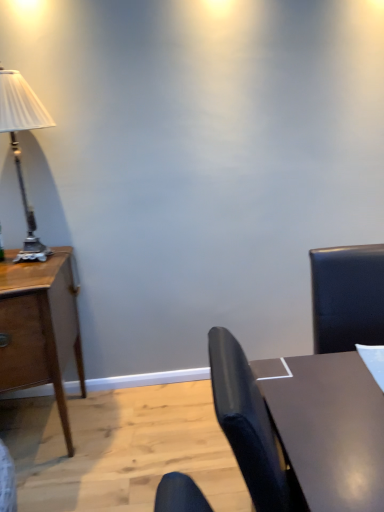
What do you see at coordinates (18, 146) in the screenshot? I see `silver metallic lamp at left` at bounding box center [18, 146].

The width and height of the screenshot is (384, 512). Find the location of `shiny brown table at lower right`. shiny brown table at lower right is located at coordinates (328, 426).

I want to click on wooden desk at left, so click(x=40, y=327).

Consider the image. Is wooden desk at left to the right of silver metallic lamp at left from the viewer's perspective?

No.

Which is in front, point (7, 353) or point (30, 88)?

The point (7, 353) is more forward.

Considering the sizes of objects wooden desk at left and silver metallic lamp at left in the image provided, who is bigger, wooden desk at left or silver metallic lamp at left?

With larger size is wooden desk at left.

Is wooden desk at left oriented away from silver metallic lamp at left?

No.

Which of these two, silver metallic lamp at left or wooden desk at left, is wider?

wooden desk at left is wider.

From the image's perspective, is silver metallic lamp at left on top of wooden desk at left?

Yes, from the image's perspective, silver metallic lamp at left is above wooden desk at left.

How distant is silver metallic lamp at left from wooden desk at left?

silver metallic lamp at left and wooden desk at left are 31.34 inches apart from each other.

Can you confirm if silver metallic lamp at left is positioned to the right of wooden desk at left?

Correct, you'll find silver metallic lamp at left to the right of wooden desk at left.

Considering the points (13, 153) and (377, 409), which point is behind, point (13, 153) or point (377, 409)?

Positioned behind is point (13, 153).

From the picture: From a real-world perspective, is silver metallic lamp at left above or below shiny brown table at lower right?

→ silver metallic lamp at left is above shiny brown table at lower right.

Is silver metallic lamp at left further to camera compared to shiny brown table at lower right?

Yes, silver metallic lamp at left is behind shiny brown table at lower right.

The image size is (384, 512). Find the location of `table lying below the silver metallic lamp at left (from the image's perspective)`. table lying below the silver metallic lamp at left (from the image's perspective) is located at coordinates pos(328,426).

Is wooden desk at left to the right of shiny brown table at lower right from the viewer's perspective?

In fact, wooden desk at left is to the left of shiny brown table at lower right.

Is wooden desk at left shorter than shiny brown table at lower right?

No, wooden desk at left is not shorter than shiny brown table at lower right.

Considering the relative sizes of wooden desk at left and shiny brown table at lower right in the image provided, is wooden desk at left wider than shiny brown table at lower right?

Correct, the width of wooden desk at left exceeds that of shiny brown table at lower right.

Is wooden desk at left positioned with its back to shiny brown table at lower right?

wooden desk at left does not have its back to shiny brown table at lower right.

In the image, is shiny brown table at lower right positioned in front of or behind silver metallic lamp at left?

shiny brown table at lower right is positioned closer to the viewer than silver metallic lamp at left.

Is shiny brown table at lower right shorter than silver metallic lamp at left?

Yes, shiny brown table at lower right is shorter than silver metallic lamp at left.

Which is more distant, (290, 405) or (22, 191)?

The point (22, 191) is more distant.

Is silver metallic lamp at left at the back of shiny brown table at lower right?

That's not correct — shiny brown table at lower right is not looking away from silver metallic lamp at left.

Is shiny brown table at lower right shorter than wooden desk at left?

Yes.

You are a GUI agent. You are given a task and a screenshot of the screen. Output one action in this format:
    pyautogui.click(x=<x>, y=<y>)
    Task: Click on the desk that is under the shiny brown table at lower right (from a real-world perspective)
    This screenshot has height=512, width=384.
    Given the screenshot: What is the action you would take?
    pyautogui.click(x=40, y=327)

Considering their positions, is shiny brown table at lower right located in front of or behind wooden desk at left?

shiny brown table at lower right is in front of wooden desk at left.

Which is closer to the camera, (x=306, y=466) or (x=29, y=339)?

The point (x=306, y=466) is in front.

Find the location of a particular element. The image size is (384, 512). lamp above the wooden desk at left (from a real-world perspective) is located at coordinates (18, 146).

Identify the location of desk that appears below the silver metallic lamp at left (from a real-world perspective). (40, 327).

Based on their spatial positions, is silver metallic lamp at left or wooden desk at left further from shiny brown table at lower right?

The object further to shiny brown table at lower right is silver metallic lamp at left.

When comparing their distances from wooden desk at left, does silver metallic lamp at left or shiny brown table at lower right seem further?

Based on the image, shiny brown table at lower right appears to be further to wooden desk at left.

Based on their spatial positions, is wooden desk at left or shiny brown table at lower right closer to silver metallic lamp at left?

wooden desk at left.

When comparing their distances from shiny brown table at lower right, does wooden desk at left or silver metallic lamp at left seem closer?

wooden desk at left.

From the image, which object appears to be nearer to wooden desk at left, shiny brown table at lower right or silver metallic lamp at left?

Among the two, silver metallic lamp at left is located nearer to wooden desk at left.

Based on their spatial positions, is shiny brown table at lower right or wooden desk at left closer to silver metallic lamp at left?

wooden desk at left.

Locate an element on the screen. lamp between wooden desk at left and shiny brown table at lower right in the horizontal direction is located at coordinates (18, 146).